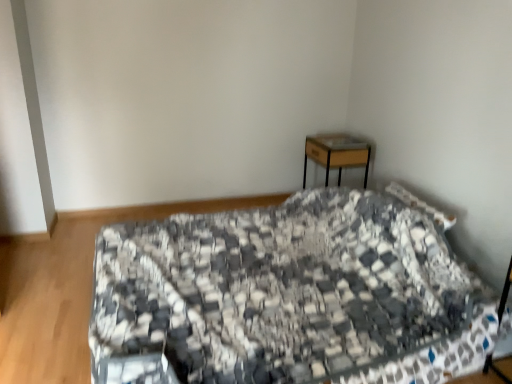
Where is `black-and-white quilted bed at center`? black-and-white quilted bed at center is located at coordinates (295, 293).

Describe the element at coordinates (295, 293) in the screenshot. This screenshot has height=384, width=512. I see `black-and-white quilted bed at center` at that location.

The width and height of the screenshot is (512, 384). What are the coordinates of `wooden desk at upper right` in the screenshot? It's located at (337, 153).

Image resolution: width=512 pixels, height=384 pixels. Describe the element at coordinates (337, 153) in the screenshot. I see `wooden desk at upper right` at that location.

You are a GUI agent. You are given a task and a screenshot of the screen. Output one action in this format:
    pyautogui.click(x=<x>, y=<y>)
    Task: Click on the black-and-white quilted bed at center
    This screenshot has height=384, width=512.
    Given the screenshot: What is the action you would take?
    pyautogui.click(x=295, y=293)

In the scene shown: Which is more to the right, wooden desk at upper right or black-and-white quilted bed at center?

wooden desk at upper right.

Is wooden desk at upper right closer to the viewer compared to black-and-white quilted bed at center?

No, it is behind black-and-white quilted bed at center.

Considering the points (351, 137) and (156, 230), which point is behind, point (351, 137) or point (156, 230)?

The point (351, 137) is farther.

From the image's perspective, which one is positioned lower, wooden desk at upper right or black-and-white quilted bed at center?

black-and-white quilted bed at center, from the image's perspective.

From a real-world perspective, is wooden desk at upper right on top of black-and-white quilted bed at center?

Yes.

Which object is wider, wooden desk at upper right or black-and-white quilted bed at center?

Wider between the two is black-and-white quilted bed at center.

Considering the relative sizes of wooden desk at upper right and black-and-white quilted bed at center in the image provided, is wooden desk at upper right shorter than black-and-white quilted bed at center?

Indeed, wooden desk at upper right has a lesser height compared to black-and-white quilted bed at center.

Looking at this image, considering the sizes of objects wooden desk at upper right and black-and-white quilted bed at center in the image provided, who is smaller, wooden desk at upper right or black-and-white quilted bed at center?

wooden desk at upper right.

Is wooden desk at upper right situated inside black-and-white quilted bed at center or outside?

wooden desk at upper right is located beyond the bounds of black-and-white quilted bed at center.

Is wooden desk at upper right not close to black-and-white quilted bed at center?

Yes, wooden desk at upper right is far from black-and-white quilted bed at center.

From the picture: Does wooden desk at upper right turn towards black-and-white quilted bed at center?

No, wooden desk at upper right does not turn towards black-and-white quilted bed at center.

Based on the photo, what's the angular difference between wooden desk at upper right and black-and-white quilted bed at center's facing directions?

They differ by 1.7 degrees in their facing directions.

At what (x,y) coordinates should I click in order to perform the action: click on bed that appears on the left of wooden desk at upper right. Please return your answer as a coordinate pair (x, y). Looking at the image, I should click on (295, 293).

Does black-and-white quilted bed at center appear on the right side of wooden desk at upper right?

In fact, black-and-white quilted bed at center is to the left of wooden desk at upper right.

Between black-and-white quilted bed at center and wooden desk at upper right, which one is positioned behind?

wooden desk at upper right.

Is point (456, 371) closer or farther from the camera than point (338, 161)?

Point (456, 371) is closer to the camera than point (338, 161).

From the image's perspective, between black-and-white quilted bed at center and wooden desk at upper right, who is located below?

black-and-white quilted bed at center appears lower in the image.

From a real-world perspective, is black-and-white quilted bed at center over wooden desk at upper right?

No, from a real-world perspective, black-and-white quilted bed at center is not above wooden desk at upper right.

Considering the sizes of black-and-white quilted bed at center and wooden desk at upper right in the image, is black-and-white quilted bed at center wider or thinner than wooden desk at upper right?

In the image, black-and-white quilted bed at center appears to be wider than wooden desk at upper right.

Who is shorter, black-and-white quilted bed at center or wooden desk at upper right?

wooden desk at upper right.

Considering the sizes of black-and-white quilted bed at center and wooden desk at upper right in the image, is black-and-white quilted bed at center bigger or smaller than wooden desk at upper right?

black-and-white quilted bed at center is bigger than wooden desk at upper right.

Could wooden desk at upper right be considered to be inside black-and-white quilted bed at center?

No, wooden desk at upper right is not inside black-and-white quilted bed at center.

Is black-and-white quilted bed at center positioned far away from wooden desk at upper right?

Answer: Yes, black-and-white quilted bed at center and wooden desk at upper right are located far from each other.

Is black-and-white quilted bed at center facing away from wooden desk at upper right?

black-and-white quilted bed at center is not turned away from wooden desk at upper right.

In the image, there is a wooden desk at upper right. Where is `bed below it (from a real-world perspective)`? bed below it (from a real-world perspective) is located at coordinates (295, 293).

The image size is (512, 384). In the image, there is a wooden desk at upper right. In order to click on bed below it (from a real-world perspective) in this screenshot , I will do `click(295, 293)`.

This screenshot has width=512, height=384. What are the coordinates of `bed that appears in front of the wooden desk at upper right` in the screenshot? It's located at (295, 293).